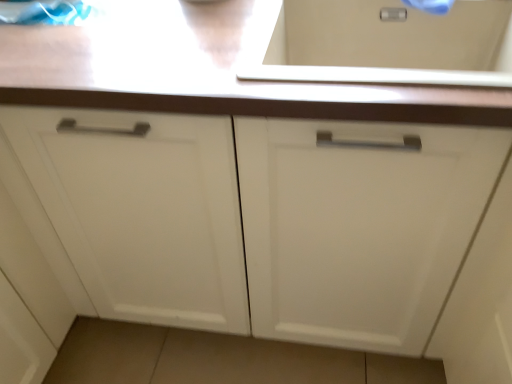
Question: Should I look upward or downward to see white matte cabinet at center?

Choices:
 (A) down
 (B) up

Answer: (B)